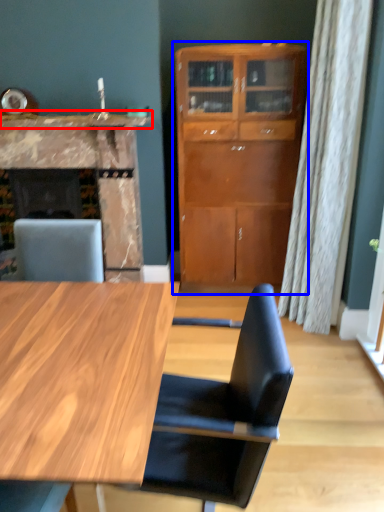
Question: Which point is further to the camera, counter top (highlighted by a red box) or cabinetry (highlighted by a blue box)?

Choices:
 (A) counter top
 (B) cabinetry

Answer: (A)